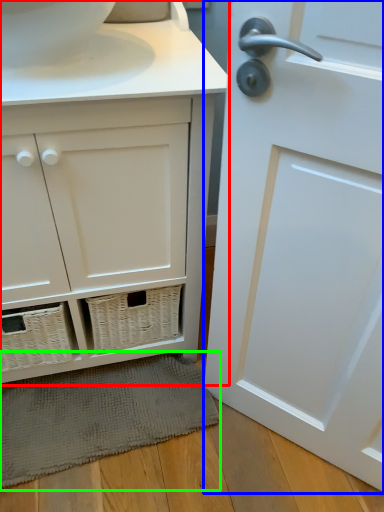
Question: Which object is positioned farthest from bathroom cabinet (highlighted by a red box)? Select from door (highlighted by a blue box) and bath mat (highlighted by a green box).

Choices:
 (A) door
 (B) bath mat

Answer: (B)